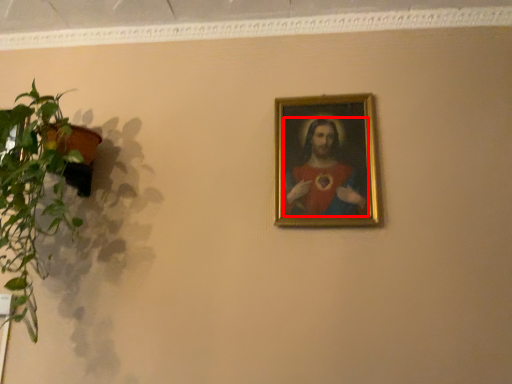
Question: From the image's perspective, where is person (annotated by the red box) located relative to houseplant?

Choices:
 (A) above
 (B) below

Answer: (A)